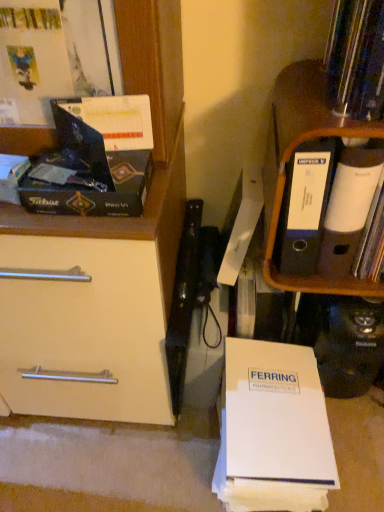
Question: Is orange wood shelf at right aimed at white paper at upper right, which is the second paperback book from top to bottom?

Choices:
 (A) yes
 (B) no

Answer: (B)

Question: Is orange wood shelf at right not close to white paper at upper right, arranged as the 2th paperback book when ordered from the bottom?

Choices:
 (A) no
 (B) yes

Answer: (A)

Question: Does orange wood shelf at right have a smaller size compared to white paper at upper right, which is the second paperback book from top to bottom?

Choices:
 (A) yes
 (B) no

Answer: (B)

Question: Does orange wood shelf at right have a lesser height compared to white paper at upper right, the 1th paperback book positioned from the right?

Choices:
 (A) no
 (B) yes

Answer: (A)

Question: From the image's perspective, is orange wood shelf at right on top of white paper at upper right, marked as the 3th paperback book in a left-to-right arrangement?

Choices:
 (A) yes
 (B) no

Answer: (A)

Question: Is white paper at upper right, marked as the 3th paperback book in a left-to-right arrangement, inside orange wood shelf at right?

Choices:
 (A) no
 (B) yes

Answer: (A)

Question: Does white paper at upper right, arranged as the 2th paperback book when ordered from the bottom, come in front of white paper at lower center, which ranks as the second paperback book in left-to-right order?

Choices:
 (A) yes
 (B) no

Answer: (A)

Question: Does white paper at upper right, arranged as the 2th paperback book when ordered from the bottom, have a greater width compared to white paper at lower center, which is counted as the third paperback book, starting from the top?

Choices:
 (A) yes
 (B) no

Answer: (B)

Question: Does white paper at upper right, which is the second paperback book from top to bottom, appear on the left side of white paper at lower center, which ranks as the second paperback book in left-to-right order?

Choices:
 (A) yes
 (B) no

Answer: (B)

Question: Is white paper at upper right, marked as the 3th paperback book in a left-to-right arrangement, to the right of white paper at lower center, which ranks as the second paperback book in left-to-right order, from the viewer's perspective?

Choices:
 (A) no
 (B) yes

Answer: (B)

Question: Is white paper at upper right, the 1th paperback book positioned from the right, shorter than white paper at lower center, the first paperback book when ordered from bottom to top?

Choices:
 (A) no
 (B) yes

Answer: (A)

Question: Is white paper at upper right, marked as the 3th paperback book in a left-to-right arrangement, aimed at white paper at lower center, arranged as the second paperback book when viewed from the right?

Choices:
 (A) yes
 (B) no

Answer: (B)

Question: Is matte black book at upper left located within white paper at upper right, the 1th paperback book positioned from the right?

Choices:
 (A) no
 (B) yes

Answer: (A)